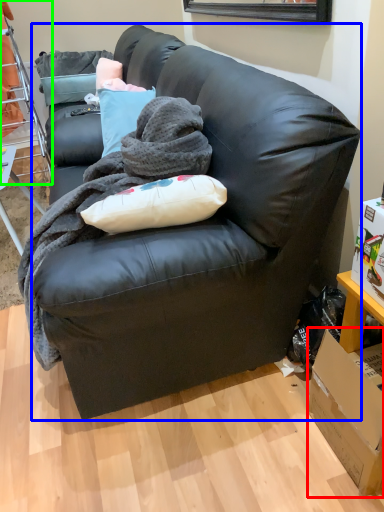
Question: Which is farther away from box (highlighted by a red box)? studio couch (highlighted by a blue box) or bunk bed (highlighted by a green box)?

Choices:
 (A) studio couch
 (B) bunk bed

Answer: (B)